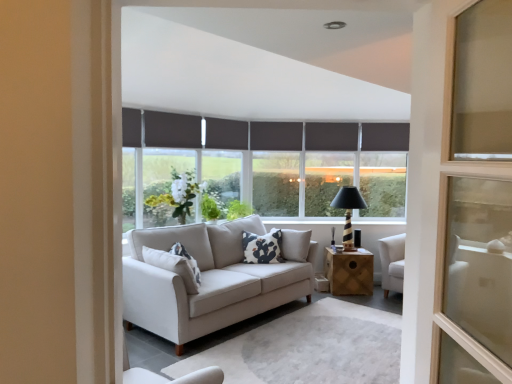
Question: Should I look upward or downward to see white glass vase at center, which ranks as the 5th window in right-to-left order?

Choices:
 (A) up
 (B) down

Answer: (B)

Question: Does black striped wood table lamp at center have a lesser height compared to dark gray roller blind at center, the second window when ordered from right to left?

Choices:
 (A) yes
 (B) no

Answer: (A)

Question: Could dark gray roller blind at center, the fourth window positioned from the left, be considered to be inside black striped wood table lamp at center?

Choices:
 (A) no
 (B) yes

Answer: (A)

Question: Is black striped wood table lamp at center directly adjacent to dark gray roller blind at center, the second window when ordered from right to left?

Choices:
 (A) no
 (B) yes

Answer: (A)

Question: From a real-world perspective, is black striped wood table lamp at center over dark gray roller blind at center, the second window when ordered from right to left?

Choices:
 (A) no
 (B) yes

Answer: (A)

Question: From the image's perspective, is black striped wood table lamp at center on top of dark gray roller blind at center, the fourth window positioned from the left?

Choices:
 (A) yes
 (B) no

Answer: (B)

Question: Can you confirm if black striped wood table lamp at center is smaller than dark gray roller blind at center, the second window when ordered from right to left?

Choices:
 (A) no
 (B) yes

Answer: (A)

Question: Can you confirm if dark gray roller blind at center, arranged as the 3th window when viewed from the right, is smaller than white glass vase at center, the first window positioned from the left?

Choices:
 (A) yes
 (B) no

Answer: (A)

Question: Does dark gray roller blind at center, the third window when ordered from left to right, have a lesser width compared to white glass vase at center, the first window positioned from the left?

Choices:
 (A) no
 (B) yes

Answer: (B)

Question: Is dark gray roller blind at center, arranged as the 3th window when viewed from the right, taller than white glass vase at center, which ranks as the 5th window in right-to-left order?

Choices:
 (A) yes
 (B) no

Answer: (A)

Question: Is dark gray roller blind at center, the third window when ordered from left to right, next to white glass vase at center, the first window positioned from the left, and touching it?

Choices:
 (A) yes
 (B) no

Answer: (B)

Question: Is dark gray roller blind at center, arranged as the 3th window when viewed from the right, positioned beyond the bounds of white glass vase at center, which ranks as the 5th window in right-to-left order?

Choices:
 (A) yes
 (B) no

Answer: (A)

Question: From the image's perspective, is dark gray roller blind at center, arranged as the 3th window when viewed from the right, over white glass vase at center, which ranks as the 5th window in right-to-left order?

Choices:
 (A) yes
 (B) no

Answer: (A)

Question: From the image's perspective, is dark grey fabric curtain at center, which is counted as the 2th curtain, starting from the left, on white printed cushion at center?

Choices:
 (A) no
 (B) yes

Answer: (B)